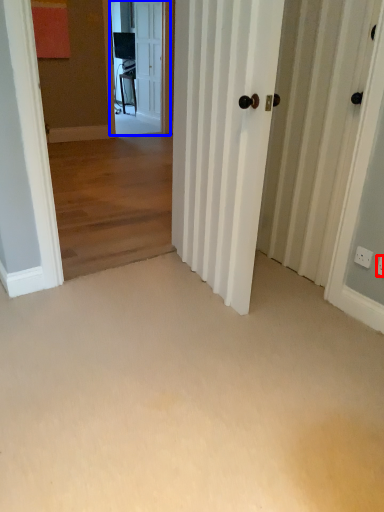
Question: Among these objects, which one is nearest to the camera, electric outlet (highlighted by a red box) or screen door (highlighted by a blue box)?

Choices:
 (A) electric outlet
 (B) screen door

Answer: (A)